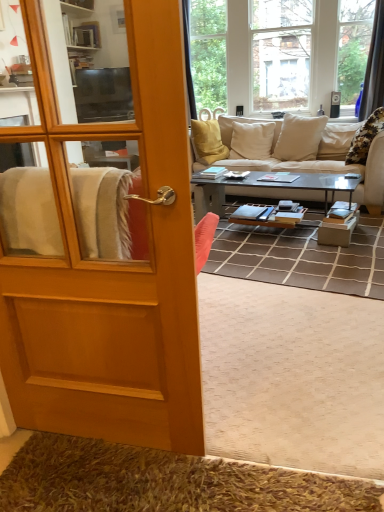
Question: Is the surface of metallic gray coffee table at center in direct contact with brown shaggy rug at lower left?

Choices:
 (A) no
 (B) yes

Answer: (A)

Question: Is metallic gray coffee table at center in front of brown shaggy rug at lower left?

Choices:
 (A) yes
 (B) no

Answer: (B)

Question: From the image's perspective, is metallic gray coffee table at center located beneath brown shaggy rug at lower left?

Choices:
 (A) no
 (B) yes

Answer: (A)

Question: Would you consider metallic gray coffee table at center to be distant from brown shaggy rug at lower left?

Choices:
 (A) no
 (B) yes

Answer: (B)

Question: Is metallic gray coffee table at center thinner than brown shaggy rug at lower left?

Choices:
 (A) no
 (B) yes

Answer: (A)

Question: Considering the positions of wooden door at left and beige fabric couch at center in the image, is wooden door at left bigger or smaller than beige fabric couch at center?

Choices:
 (A) small
 (B) big

Answer: (A)

Question: Is wooden door at left taller or shorter than beige fabric couch at center?

Choices:
 (A) short
 (B) tall

Answer: (B)

Question: From the image's perspective, is wooden door at left above or below beige fabric couch at center?

Choices:
 (A) above
 (B) below

Answer: (B)

Question: Does point (177, 113) appear closer or farther from the camera than point (230, 117)?

Choices:
 (A) farther
 (B) closer

Answer: (B)

Question: Relative to brown shaggy rug at lower left, is wooden door at left in front or behind?

Choices:
 (A) front
 (B) behind

Answer: (A)

Question: From their relative heights in the image, would you say wooden door at left is taller or shorter than brown shaggy rug at lower left?

Choices:
 (A) tall
 (B) short

Answer: (A)

Question: Which is correct: wooden door at left is inside brown shaggy rug at lower left, or outside of it?

Choices:
 (A) outside
 (B) inside

Answer: (A)

Question: From a real-world perspective, relative to brown shaggy rug at lower left, is wooden door at left vertically above or below?

Choices:
 (A) above
 (B) below

Answer: (A)

Question: Is metallic gray coffee table at center taller or shorter than wooden door at left?

Choices:
 (A) tall
 (B) short

Answer: (B)

Question: Is point [x=324, y=208] closer or farther from the camera than point [x=54, y=322]?

Choices:
 (A) closer
 (B) farther

Answer: (B)